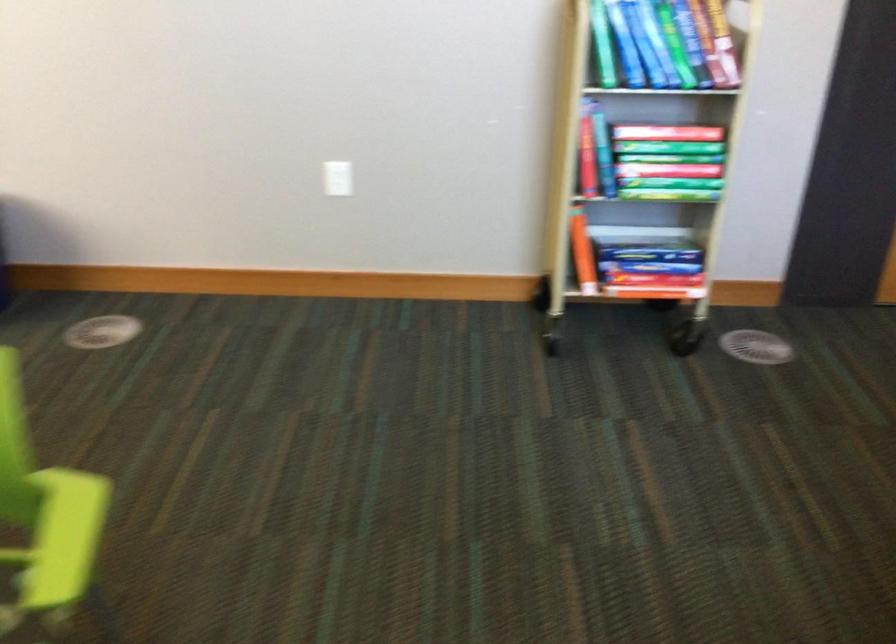
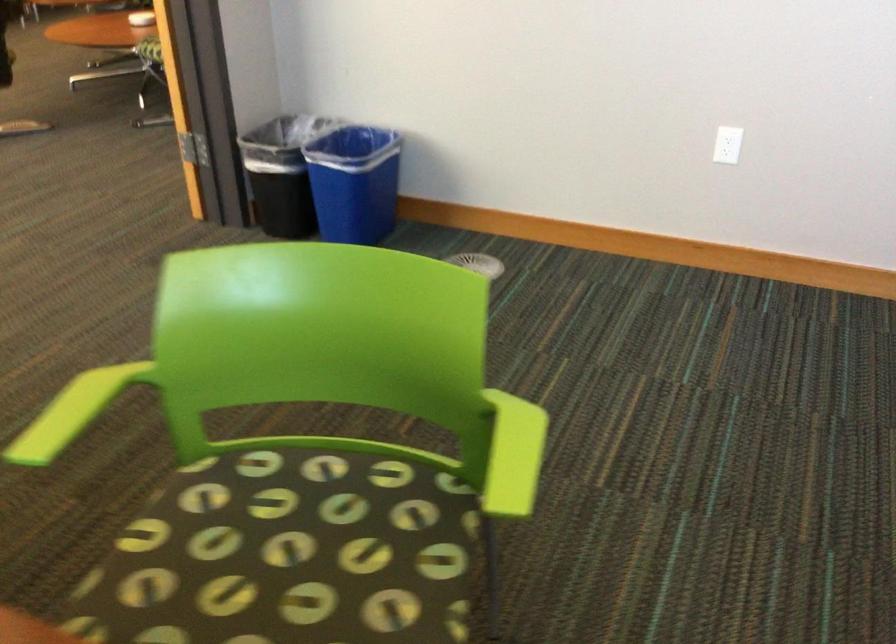
Question: What movement of the cameraman would produce the second image?

Choices:
 (A) Left
 (B) Right
 (C) Forward
 (D) Backward

Answer: (A)